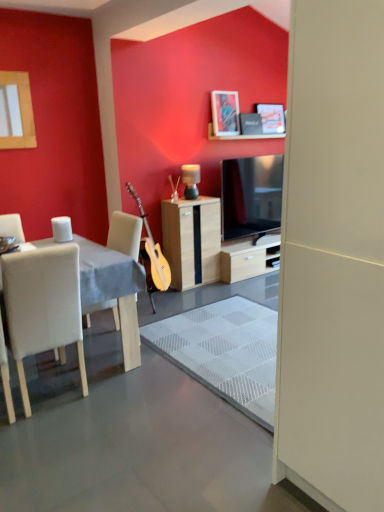
Question: From a real-world perspective, is matte black lamp at center under white glossy coffee cup at left?

Choices:
 (A) no
 (B) yes

Answer: (A)

Question: Does matte black lamp at center lie behind white glossy coffee cup at left?

Choices:
 (A) no
 (B) yes

Answer: (B)

Question: Is matte black lamp at center shorter than white glossy coffee cup at left?

Choices:
 (A) no
 (B) yes

Answer: (A)

Question: From the image's perspective, is matte black lamp at center located above white glossy coffee cup at left?

Choices:
 (A) yes
 (B) no

Answer: (A)

Question: From a real-world perspective, is matte black lamp at center located higher than white glossy coffee cup at left?

Choices:
 (A) no
 (B) yes

Answer: (B)

Question: Is white glossy coffee cup at left at the back of matte black lamp at center?

Choices:
 (A) yes
 (B) no

Answer: (B)

Question: Is white fabric table at left oriented towards wooden cabinet at center?

Choices:
 (A) no
 (B) yes

Answer: (B)

Question: Can you confirm if white fabric table at left is thinner than wooden cabinet at center?

Choices:
 (A) no
 (B) yes

Answer: (A)

Question: Is the surface of white fabric table at left in direct contact with wooden cabinet at center?

Choices:
 (A) yes
 (B) no

Answer: (B)

Question: Would you consider white fabric table at left to be distant from wooden cabinet at center?

Choices:
 (A) yes
 (B) no

Answer: (A)

Question: Does white fabric table at left have a larger size compared to wooden cabinet at center?

Choices:
 (A) yes
 (B) no

Answer: (A)

Question: From a real-world perspective, is white fabric table at left beneath wooden cabinet at center?

Choices:
 (A) no
 (B) yes

Answer: (B)

Question: Is matte black picture frame at upper center, the 2th picture frame viewed from the front, oriented away from white leather chair at left?

Choices:
 (A) yes
 (B) no

Answer: (B)